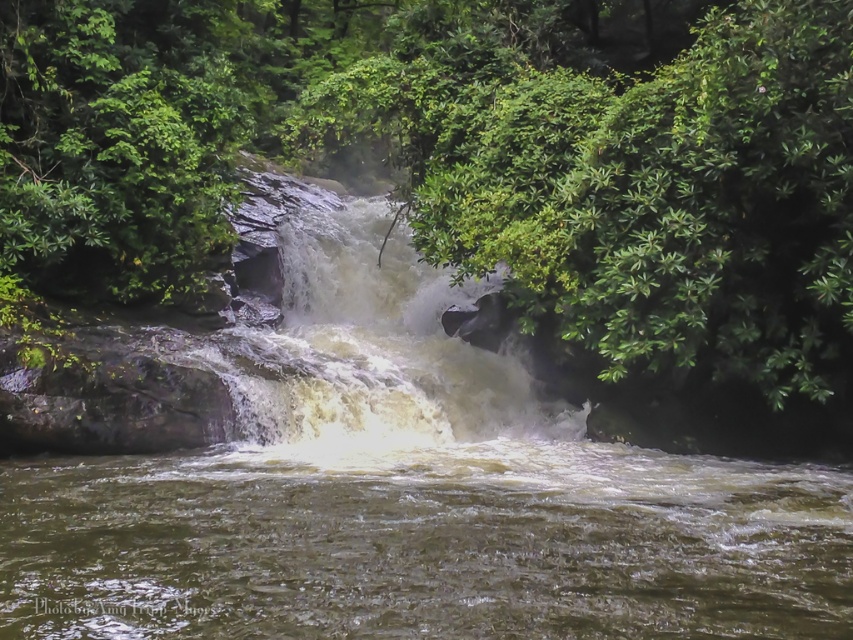
You are a hiker carrying a backpack and need to cross the area between the green leafy tree at center and the white frothy water at center. The path is narrow. Can you safely pass through if your backpack is 2 feet wide?

The distance between the green leafy tree at center and the white frothy water at center is 9.36 feet. Since your backpack is only 2 feet wide, there is sufficient space to safely pass through the 9.36 feet gap.

You are standing at the edge of the forest near the waterfall and see a point marked at coordinates point (466, 157). Based on the scene description, which object does this point belong to?

The point (466, 157) is on the green leafy tree at center.